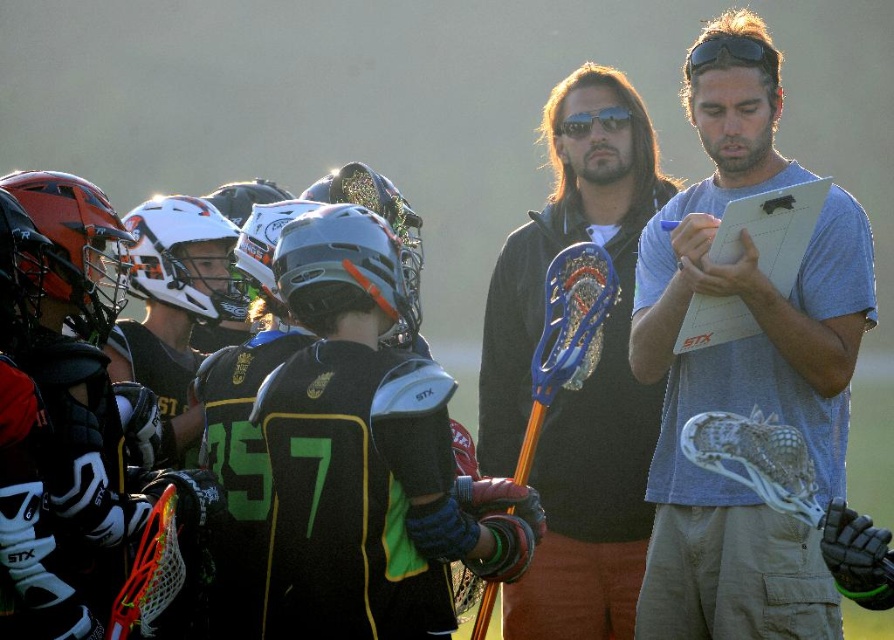
What is the color of the shirt at the point with coordinates (x=744, y=364)?

The gray cotton shirt at center is the color gray.

You are a player in the huddle and need to pass the ball to a teammate located at point (810,336). The coach says the ball must travel exactly 23.12 meters. Is this possible?

Yes, because the point is exactly 23.12 meters away from you, so passing the ball that distance would reach the teammate at point (810,336).